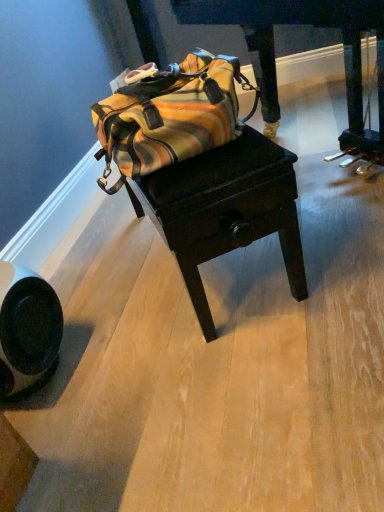
Locate an element on the screen. vacant area that is in front of wooden table at center is located at coordinates click(x=214, y=378).